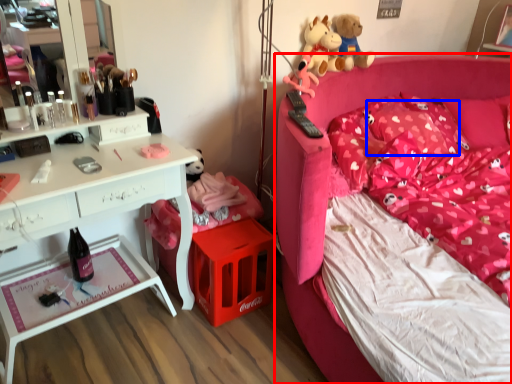
Question: Which object appears closest to the camera in this image, bed (highlighted by a red box) or pillow (highlighted by a blue box)?

Choices:
 (A) bed
 (B) pillow

Answer: (A)